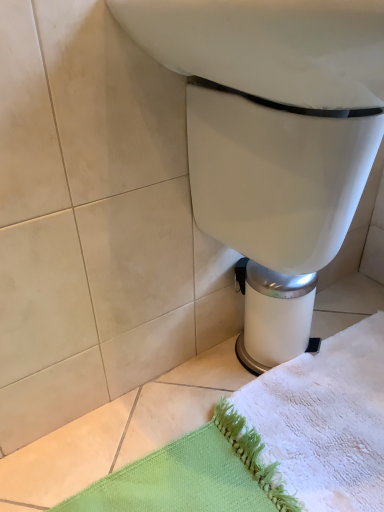
Question: From the image's perspective, relative to white glossy toilet at center, is white textured bath towel at lower right above or below?

Choices:
 (A) below
 (B) above

Answer: (A)

Question: In terms of height, does white textured bath towel at lower right look taller or shorter compared to white glossy toilet at center?

Choices:
 (A) short
 (B) tall

Answer: (A)

Question: Based on their sizes in the image, would you say white textured bath towel at lower right is bigger or smaller than white glossy toilet at center?

Choices:
 (A) small
 (B) big

Answer: (A)

Question: Is white glossy toilet at center taller or shorter than white textured bath towel at lower right?

Choices:
 (A) tall
 (B) short

Answer: (A)

Question: From the image's perspective, relative to white textured bath towel at lower right, is white glossy toilet at center above or below?

Choices:
 (A) below
 (B) above

Answer: (B)

Question: Considering the positions of white glossy toilet at center and white textured bath towel at lower right in the image, is white glossy toilet at center bigger or smaller than white textured bath towel at lower right?

Choices:
 (A) small
 (B) big

Answer: (B)

Question: Considering the positions of white glossy toilet at center and white textured bath towel at lower right in the image, is white glossy toilet at center wider or thinner than white textured bath towel at lower right?

Choices:
 (A) wide
 (B) thin

Answer: (B)